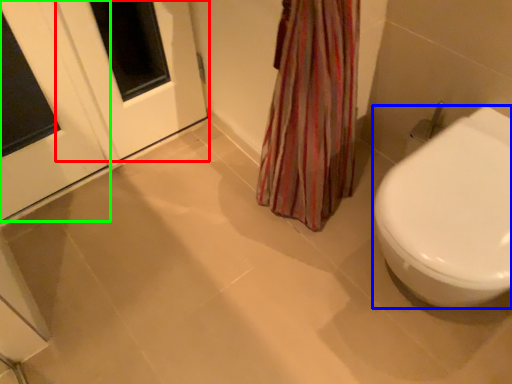
Question: Which object is the closest to the screen door (highlighted by a red box)? Choose among these: bidet (highlighted by a blue box) or door (highlighted by a green box).

Choices:
 (A) bidet
 (B) door

Answer: (B)